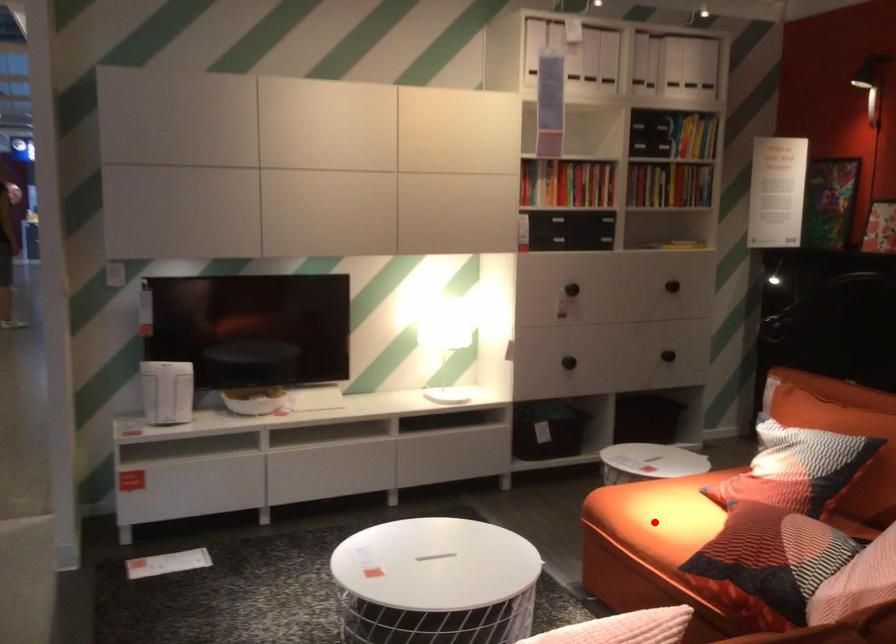
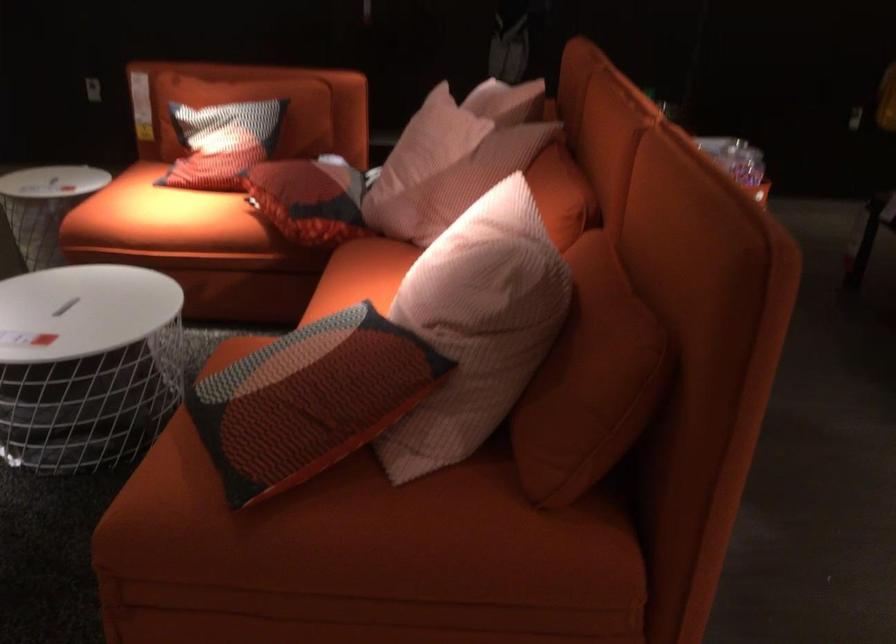
Locate, in the second image, the point that corresponds to the highlighted location in the first image.

(160, 216)